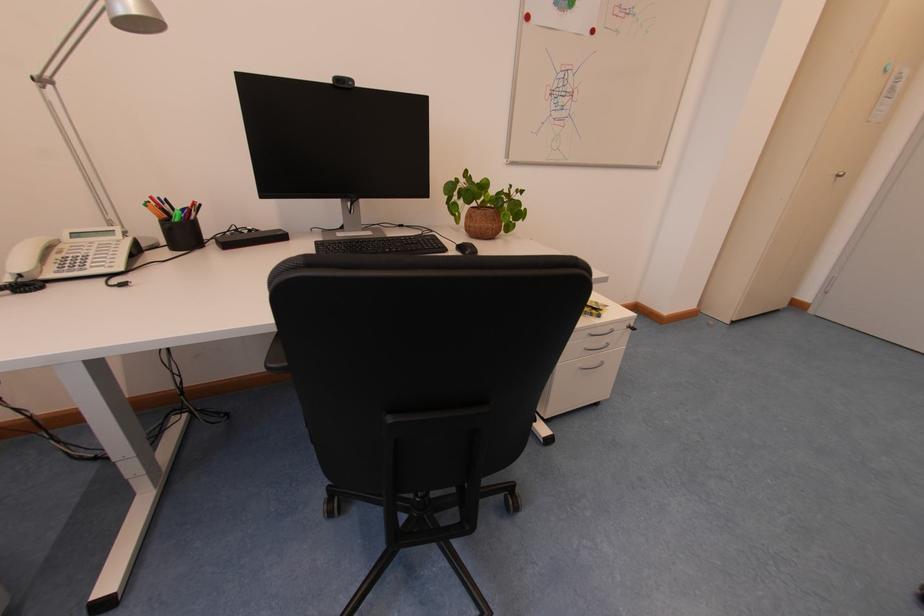
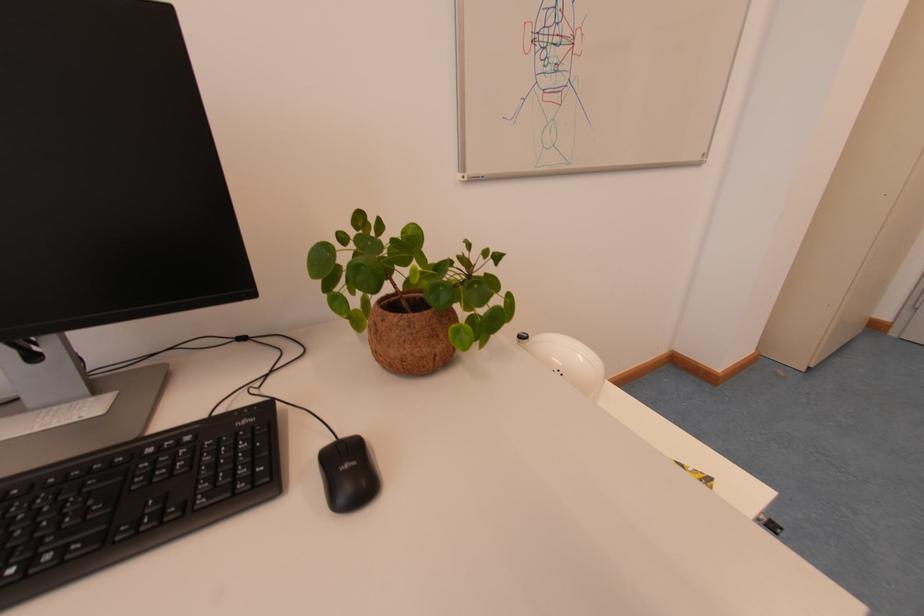
Question: How did the camera likely rotate?

Choices:
 (A) Left
 (B) Right
 (C) Up
 (D) Down

Answer: (B)